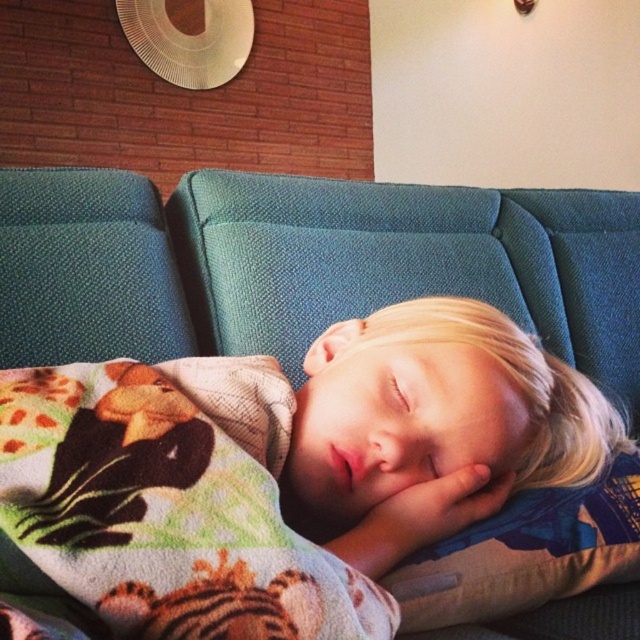
You are a photographer setting up a shoot in the room. You need to place a small lamp between the teal fabric couch at center and the soft fabric pillow at center. According to the scene, where should you position the lamp?

The teal fabric couch at center is to the left of the soft fabric pillow at center, so you should place the lamp between them, positioning it to the right of the teal fabric couch at center and to the left of the soft fabric pillow at center.

You are a babysitter trying to cover the child with the multicolored fleece blanket at center and the soft fabric pillow at center. Which item should you use to fully cover the child without needing to adjust it multiple times?

The multicolored fleece blanket at center has a larger size compared to the soft fabric pillow at center, so you should use the multicolored fleece blanket at center to fully cover the child without needing to adjust it multiple times.